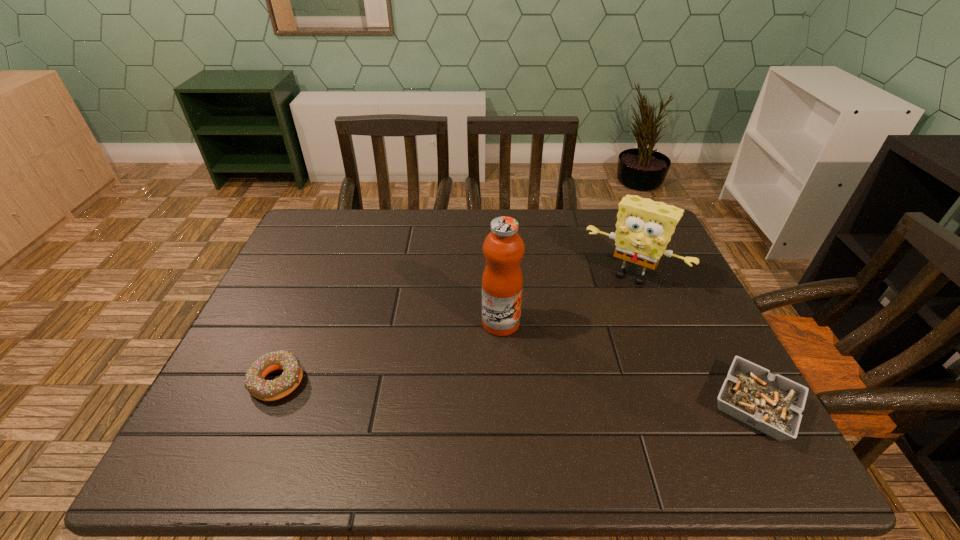
Image resolution: width=960 pixels, height=540 pixels. What are the coordinates of `the leftmost object` in the screenshot? It's located at (266, 390).

Find the location of a particular element. This screenshot has height=540, width=960. ashtray is located at coordinates (770, 403).

Find the location of a particular element. This screenshot has height=540, width=960. the second object from left to right is located at coordinates (502, 282).

The width and height of the screenshot is (960, 540). Identify the location of the third nearest object. (502, 282).

Image resolution: width=960 pixels, height=540 pixels. Identify the location of the farthest object. (644, 227).

At what (x,y) coordinates should I click in order to perform the action: click on the third shortest object. Please return your answer as a coordinate pair (x, y). The height and width of the screenshot is (540, 960). Looking at the image, I should click on (644, 227).

This screenshot has height=540, width=960. I want to click on vacant region located on the back of the doughnut, so click(x=298, y=334).

The width and height of the screenshot is (960, 540). Identify the location of free space located on the back of the ashtray. (685, 274).

Locate an element on the screen. vacant space located on the front label of the second farthest object is located at coordinates (547, 381).

The width and height of the screenshot is (960, 540). Find the location of `vacant space located on the front label of the second farthest object`. vacant space located on the front label of the second farthest object is located at coordinates (544, 378).